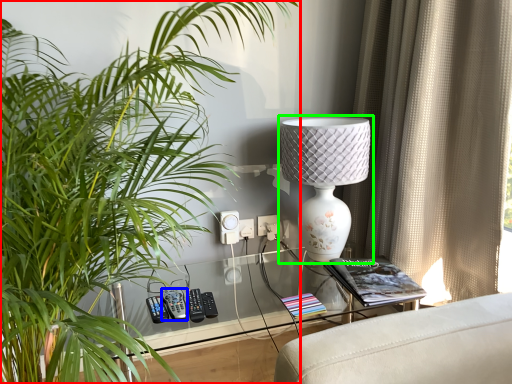
Question: Estimate the real-world distances between objects in this image. Which object is farther from houseplant (highlighted by a red box), control (highlighted by a blue box) or lamp (highlighted by a green box)?

Choices:
 (A) control
 (B) lamp

Answer: (B)